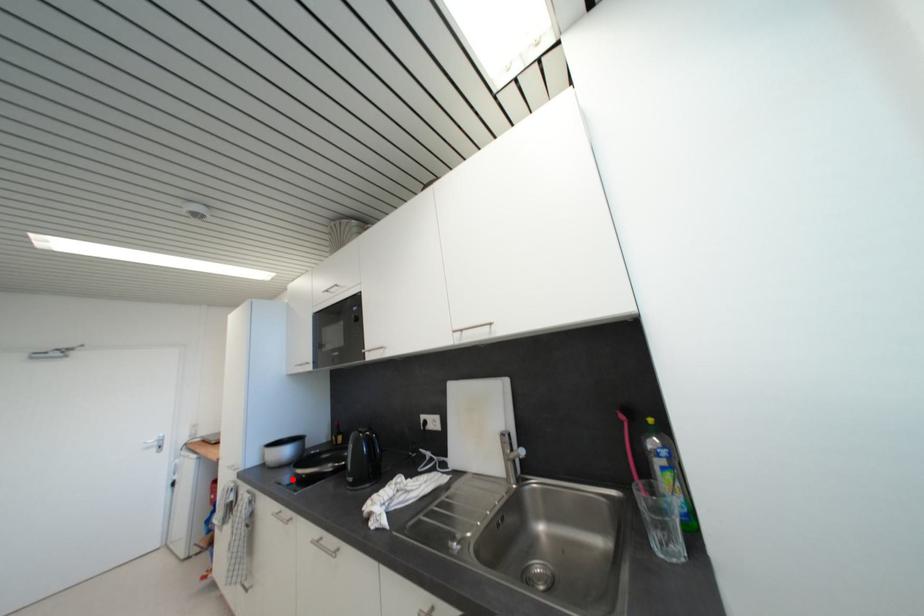
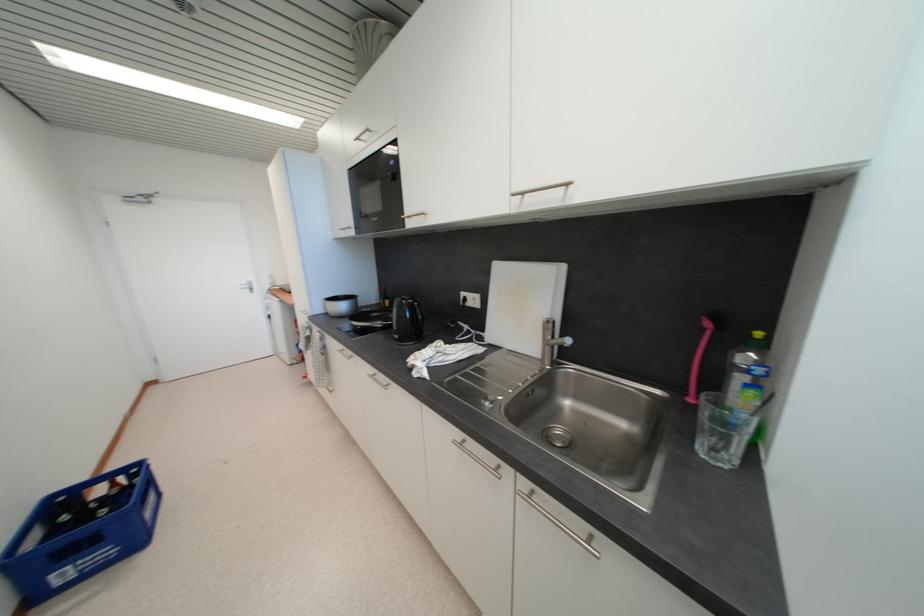
Locate, in the second image, the point that corresponds to the highlighted location in the first image.

(351, 328)